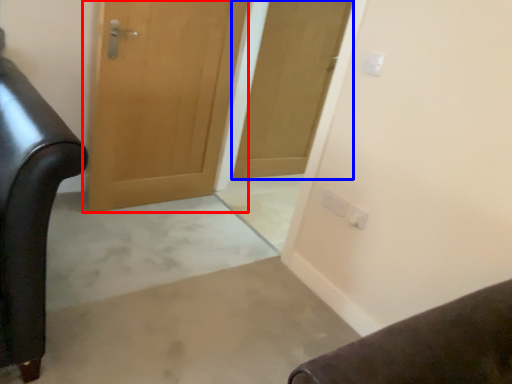
Question: Which object is closer to the camera taking this photo, door (highlighted by a red box) or door (highlighted by a blue box)?

Choices:
 (A) door
 (B) door

Answer: (A)